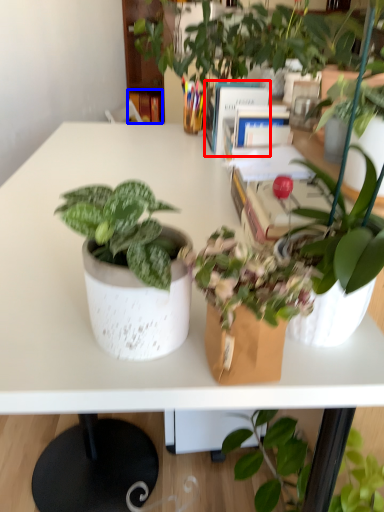
Question: Which object appears farthest to the camera in this image, book (highlighted by a red box) or book (highlighted by a blue box)?

Choices:
 (A) book
 (B) book

Answer: (B)